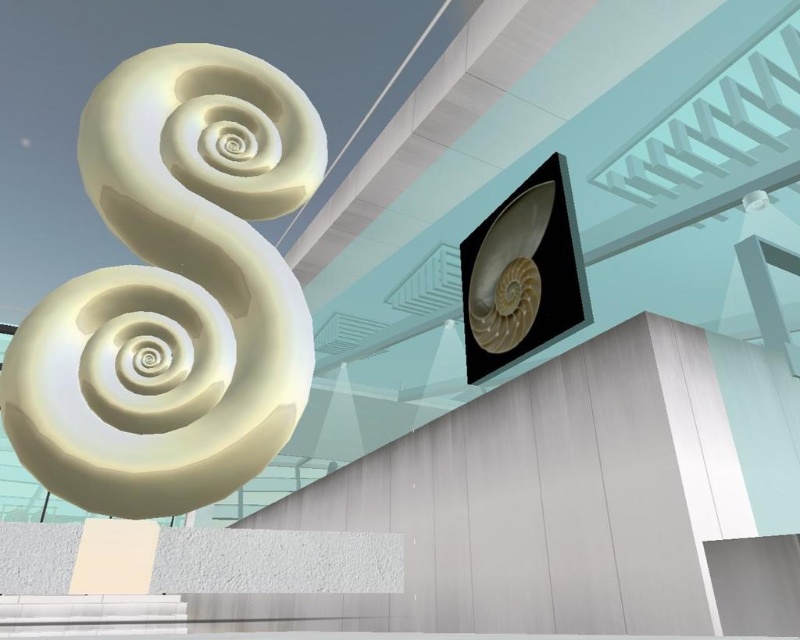
Question: Which object is closer to the camera taking this photo?

Choices:
 (A) matte white shell at upper right
 (B) white glossy sculpture at upper left

Answer: (B)

Question: Can you confirm if white glossy sculpture at upper left is thinner than matte white shell at upper right?

Choices:
 (A) yes
 (B) no

Answer: (B)

Question: Which point is closer to the camera?

Choices:
 (A) matte white shell at upper right
 (B) white glossy sculpture at upper left

Answer: (B)

Question: Is white glossy sculpture at upper left smaller than matte white shell at upper right?

Choices:
 (A) yes
 (B) no

Answer: (A)

Question: Can you confirm if white glossy sculpture at upper left is bigger than matte white shell at upper right?

Choices:
 (A) yes
 (B) no

Answer: (B)